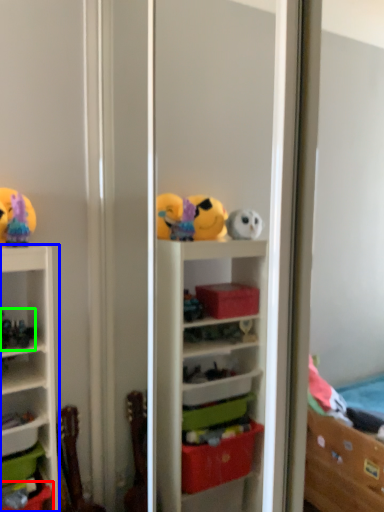
Question: Which object is the farthest from storage box (highlighted by a red box)? Choose among these: shelf (highlighted by a blue box) or toy (highlighted by a green box).

Choices:
 (A) shelf
 (B) toy

Answer: (B)